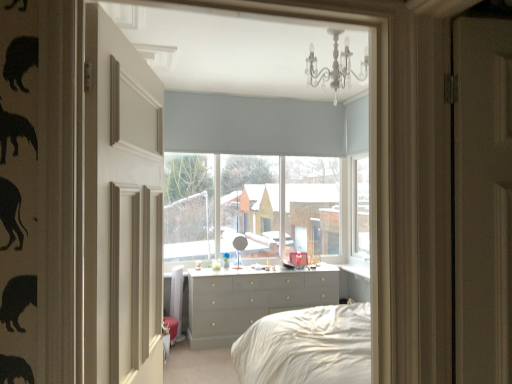
Question: Does matte gray roller blind at center touch matte gray dresser at center?

Choices:
 (A) no
 (B) yes

Answer: (A)

Question: From the image's perspective, would you say matte gray roller blind at center is shown under matte gray dresser at center?

Choices:
 (A) no
 (B) yes

Answer: (A)

Question: Can you confirm if matte gray roller blind at center is smaller than matte gray dresser at center?

Choices:
 (A) no
 (B) yes

Answer: (A)

Question: Does matte gray roller blind at center have a larger size compared to matte gray dresser at center?

Choices:
 (A) no
 (B) yes

Answer: (B)

Question: Can you confirm if matte gray roller blind at center is wider than matte gray dresser at center?

Choices:
 (A) yes
 (B) no

Answer: (B)

Question: Considering the positions of white crystal chandelier at upper center and matte gray roller blind at center in the image, is white crystal chandelier at upper center taller or shorter than matte gray roller blind at center?

Choices:
 (A) short
 (B) tall

Answer: (A)

Question: Considering their positions, is white crystal chandelier at upper center located in front of or behind matte gray roller blind at center?

Choices:
 (A) front
 (B) behind

Answer: (A)

Question: From a real-world perspective, is white crystal chandelier at upper center positioned above or below matte gray roller blind at center?

Choices:
 (A) below
 (B) above

Answer: (B)

Question: Based on their sizes in the image, would you say white crystal chandelier at upper center is bigger or smaller than matte gray roller blind at center?

Choices:
 (A) big
 (B) small

Answer: (B)

Question: Does point click(333, 104) appear closer or farther from the camera than point click(130, 324)?

Choices:
 (A) farther
 (B) closer

Answer: (A)

Question: Based on their positions, is white crystal chandelier at upper center located to the left or right of matte white door at left?

Choices:
 (A) right
 (B) left

Answer: (A)

Question: From a real-world perspective, is white crystal chandelier at upper center above or below matte white door at left?

Choices:
 (A) above
 (B) below

Answer: (A)

Question: Relative to matte white door at left, is white crystal chandelier at upper center in front or behind?

Choices:
 (A) front
 (B) behind

Answer: (B)

Question: Looking at their shapes, would you say matte gray roller blind at center is wider or thinner than matte gray dresser at center?

Choices:
 (A) thin
 (B) wide

Answer: (A)

Question: Is matte gray roller blind at center to the left or to the right of matte gray dresser at center in the image?

Choices:
 (A) right
 (B) left

Answer: (A)